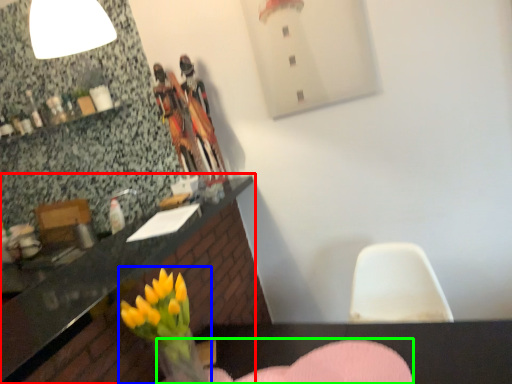
Question: Which object is the farthest from countertop (highlighted by a red box)? Choose among these: floral arrangement (highlighted by a blue box) or armchair (highlighted by a green box).

Choices:
 (A) floral arrangement
 (B) armchair

Answer: (B)